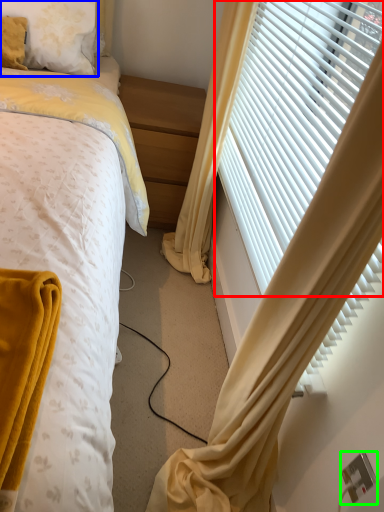
Question: Which object is positioned closest to window blind (highlighted by a red box)? Select from pillow (highlighted by a blue box) and electric outlet (highlighted by a green box).

Choices:
 (A) pillow
 (B) electric outlet

Answer: (A)